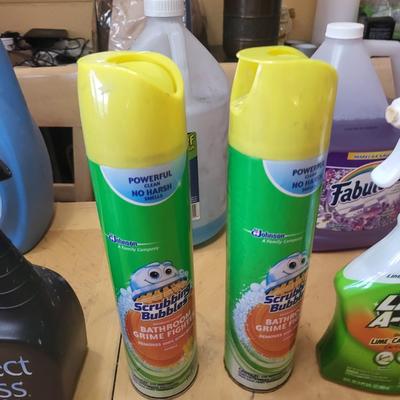
Locate an element on the screen. This screenshot has width=400, height=400. back of chair is located at coordinates (60, 90).